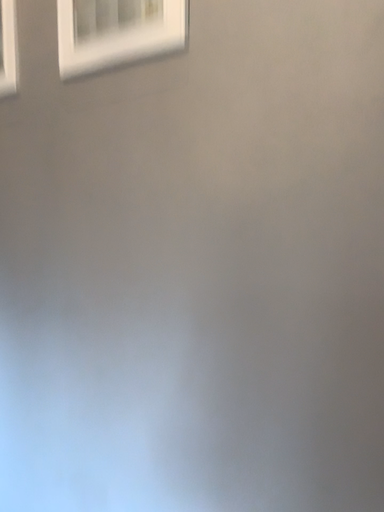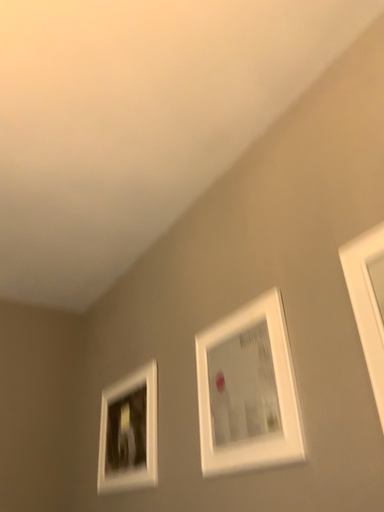
Question: How did the camera likely rotate when shooting the video?

Choices:
 (A) rotated left
 (B) rotated right

Answer: (A)